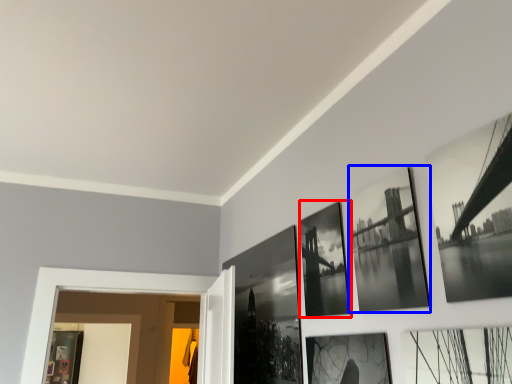
Question: Which object appears closest to the camera in this image, picture frame (highlighted by a red box) or picture frame (highlighted by a blue box)?

Choices:
 (A) picture frame
 (B) picture frame

Answer: (B)